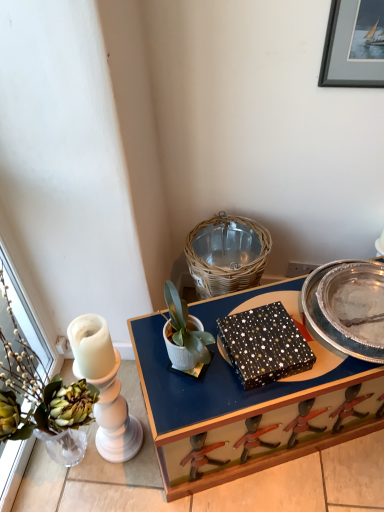
The height and width of the screenshot is (512, 384). Identify the location of free location above black textured box at center (from a real-world perspective). (267, 332).